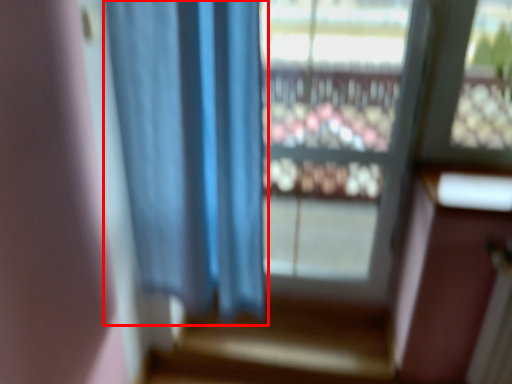
Question: From the image's perspective, what is the correct spatial positioning of curtain (annotated by the red box) in reference to window?

Choices:
 (A) below
 (B) above

Answer: (A)